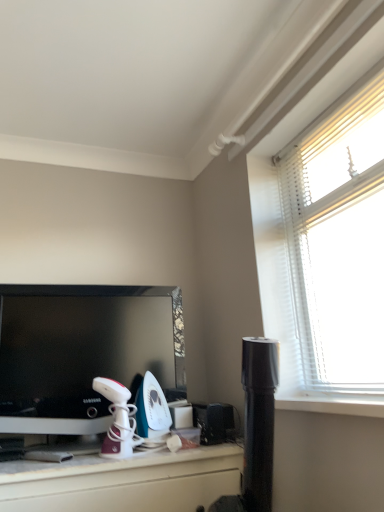
What do you see at coordinates (214, 422) in the screenshot? I see `black plastic speaker at lower center, which ranks as the third appliance in left-to-right order` at bounding box center [214, 422].

In order to face black plastic speaker at lower center, which ranks as the third appliance in left-to-right order, should I rotate leftwards or rightwards?

You should rotate right by 4.251 degrees.

Image resolution: width=384 pixels, height=512 pixels. What do you see at coordinates (151, 409) in the screenshot? I see `teal glossy iron at center, acting as the 2th appliance starting from the right` at bounding box center [151, 409].

The width and height of the screenshot is (384, 512). Identify the location of white glossy iron at center, marked as the first appliance in a left-to-right arrangement. (118, 419).

This screenshot has height=512, width=384. What are the coordinates of `black plastic speaker at lower center, which ranks as the third appliance in left-to-right order` in the screenshot? It's located at (214, 422).

Is the depth of black glossy television at left less than that of black plastic speaker at lower center, arranged as the first appliance when viewed from the right?

Yes.

Based on the photo, is black glossy television at left taller or shorter than black plastic speaker at lower center, arranged as the first appliance when viewed from the right?

Clearly, black glossy television at left is taller compared to black plastic speaker at lower center, arranged as the first appliance when viewed from the right.

Based on their positions, is black glossy television at left located to the left or right of black plastic speaker at lower center, arranged as the first appliance when viewed from the right?

black glossy television at left is to the left of black plastic speaker at lower center, arranged as the first appliance when viewed from the right.

Could you tell me if black glossy television at left is turned towards black plastic speaker at lower center, arranged as the first appliance when viewed from the right?

No, black glossy television at left is not facing towards black plastic speaker at lower center, arranged as the first appliance when viewed from the right.

From a real-world perspective, who is located lower, black glossy television at left or white glossy iron at center, marked as the first appliance in a left-to-right arrangement?

white glossy iron at center, marked as the first appliance in a left-to-right arrangement, from a real-world perspective.

Is the surface of black glossy television at left in direct contact with white glossy iron at center, marked as the first appliance in a left-to-right arrangement?

They are not placed beside each other.

Which is in front, point (119, 313) or point (109, 428)?

Point (109, 428)

How many degrees apart are the facing directions of teal glossy iron at center, the second appliance positioned from the left, and white glossy iron at center, marked as the first appliance in a left-to-right arrangement?

The facing directions of teal glossy iron at center, the second appliance positioned from the left, and white glossy iron at center, marked as the first appliance in a left-to-right arrangement, are 20.9 degrees apart.

Could you tell me if teal glossy iron at center, acting as the 2th appliance starting from the right, is facing white glossy iron at center, arranged as the third appliance when viewed from the right?

No, teal glossy iron at center, acting as the 2th appliance starting from the right, is not facing towards white glossy iron at center, arranged as the third appliance when viewed from the right.

Locate an element on the screen. The height and width of the screenshot is (512, 384). appliance on the left of teal glossy iron at center, the second appliance positioned from the left is located at coordinates (118, 419).

Does point (154, 408) appear closer or farther from the camera than point (136, 410)?

Point (154, 408) is farther from the camera than point (136, 410).

Who is bigger, white glossy iron at center, arranged as the third appliance when viewed from the right, or teal glossy iron at center, acting as the 2th appliance starting from the right?

With larger size is teal glossy iron at center, acting as the 2th appliance starting from the right.

Is white glossy iron at center, marked as the first appliance in a left-to-right arrangement, positioned with its back to teal glossy iron at center, the second appliance positioned from the left?

white glossy iron at center, marked as the first appliance in a left-to-right arrangement, does not have its back to teal glossy iron at center, the second appliance positioned from the left.

Measure the distance between white glossy iron at center, marked as the first appliance in a left-to-right arrangement, and teal glossy iron at center, the second appliance positioned from the left.

They are 3.59 inches apart.

Is white glossy iron at center, arranged as the third appliance when viewed from the right, wider or thinner than teal glossy iron at center, acting as the 2th appliance starting from the right?

white glossy iron at center, arranged as the third appliance when viewed from the right, is thinner than teal glossy iron at center, acting as the 2th appliance starting from the right.

Would you say black glossy television at left is a long distance from teal glossy iron at center, acting as the 2th appliance starting from the right?

No.

Does black glossy television at left contain teal glossy iron at center, acting as the 2th appliance starting from the right?

Yes, black glossy television at left is surrounding teal glossy iron at center, acting as the 2th appliance starting from the right.

Which object is further away from the camera taking this photo, black glossy television at left or teal glossy iron at center, the second appliance positioned from the left?

teal glossy iron at center, the second appliance positioned from the left, is further away from the camera.

Does white glossy iron at center, marked as the first appliance in a left-to-right arrangement, have a larger size compared to black plastic speaker at lower center, arranged as the first appliance when viewed from the right?

Indeed, white glossy iron at center, marked as the first appliance in a left-to-right arrangement, has a larger size compared to black plastic speaker at lower center, arranged as the first appliance when viewed from the right.

In the scene shown: From the image's perspective, which one is positioned lower, white glossy iron at center, arranged as the third appliance when viewed from the right, or black plastic speaker at lower center, which ranks as the third appliance in left-to-right order?

black plastic speaker at lower center, which ranks as the third appliance in left-to-right order, appears lower in the image.

Is white glossy iron at center, marked as the first appliance in a left-to-right arrangement, to the left or to the right of black plastic speaker at lower center, arranged as the first appliance when viewed from the right, in the image?

white glossy iron at center, marked as the first appliance in a left-to-right arrangement, is positioned on black plastic speaker at lower center, arranged as the first appliance when viewed from the right,'s left side.

Is white glossy iron at center, marked as the first appliance in a left-to-right arrangement, positioned with its back to black plastic speaker at lower center, which ranks as the third appliance in left-to-right order?

No, white glossy iron at center, marked as the first appliance in a left-to-right arrangement,'s orientation is not away from black plastic speaker at lower center, which ranks as the third appliance in left-to-right order.

What's the angular difference between white glossy iron at center, marked as the first appliance in a left-to-right arrangement, and black glossy television at left's facing directions?

white glossy iron at center, marked as the first appliance in a left-to-right arrangement, and black glossy television at left are facing 1.45 degrees away from each other.

Find the location of a particular element. television that is above the white glossy iron at center, arranged as the third appliance when viewed from the right (from a real-world perspective) is located at coordinates 81,351.

Is white glossy iron at center, arranged as the third appliance when viewed from the right, positioned far away from black glossy television at left?

No.

Is the depth of white glossy iron at center, marked as the first appliance in a left-to-right arrangement, greater than that of black glossy television at left?

No, white glossy iron at center, marked as the first appliance in a left-to-right arrangement, is closer to the viewer.

Locate an element on the screen. This screenshot has width=384, height=512. television above the black plastic speaker at lower center, arranged as the first appliance when viewed from the right (from a real-world perspective) is located at coordinates (81, 351).

This screenshot has height=512, width=384. What are the coordinates of `the 2nd appliance directly beneath the black glossy television at left (from a real-world perspective)` in the screenshot? It's located at (118, 419).

Considering their positions, is black glossy television at left positioned closer to black plastic speaker at lower center, which ranks as the third appliance in left-to-right order, than white glossy iron at center, marked as the first appliance in a left-to-right arrangement?

Based on the image, white glossy iron at center, marked as the first appliance in a left-to-right arrangement, appears to be nearer to black plastic speaker at lower center, which ranks as the third appliance in left-to-right order.

When comparing their distances from black glossy television at left, does teal glossy iron at center, the second appliance positioned from the left, or white glossy iron at center, marked as the first appliance in a left-to-right arrangement, seem further?

The object further to black glossy television at left is teal glossy iron at center, the second appliance positioned from the left.

Looking at the image, which one is located closer to white glossy iron at center, arranged as the third appliance when viewed from the right, teal glossy iron at center, acting as the 2th appliance starting from the right, or black glossy television at left?

teal glossy iron at center, acting as the 2th appliance starting from the right, lies closer to white glossy iron at center, arranged as the third appliance when viewed from the right, than the other object.

Estimate the real-world distances between objects in this image. Which object is closer to teal glossy iron at center, acting as the 2th appliance starting from the right, black plastic speaker at lower center, arranged as the first appliance when viewed from the right, or black glossy television at left?

Based on the image, black plastic speaker at lower center, arranged as the first appliance when viewed from the right, appears to be nearer to teal glossy iron at center, acting as the 2th appliance starting from the right.

From the image, which object appears to be nearer to black glossy television at left, black plastic speaker at lower center, arranged as the first appliance when viewed from the right, or teal glossy iron at center, the second appliance positioned from the left?

teal glossy iron at center, the second appliance positioned from the left.

When comparing their distances from black plastic speaker at lower center, which ranks as the third appliance in left-to-right order, does teal glossy iron at center, acting as the 2th appliance starting from the right, or white glossy iron at center, arranged as the third appliance when viewed from the right, seem further?

Among the two, white glossy iron at center, arranged as the third appliance when viewed from the right, is located further to black plastic speaker at lower center, which ranks as the third appliance in left-to-right order.

Which object lies further to the anchor point black plastic speaker at lower center, which ranks as the third appliance in left-to-right order, white glossy iron at center, marked as the first appliance in a left-to-right arrangement, or black glossy television at left?

Among the two, black glossy television at left is located further to black plastic speaker at lower center, which ranks as the third appliance in left-to-right order.

Which object lies nearer to the anchor point teal glossy iron at center, acting as the 2th appliance starting from the right, white glossy iron at center, arranged as the third appliance when viewed from the right, or black glossy television at left?

The object closer to teal glossy iron at center, acting as the 2th appliance starting from the right, is white glossy iron at center, arranged as the third appliance when viewed from the right.

Where is `appliance between white glossy iron at center, marked as the first appliance in a left-to-right arrangement, and black plastic speaker at lower center, arranged as the first appliance when viewed from the right, in the horizontal direction`? This screenshot has width=384, height=512. appliance between white glossy iron at center, marked as the first appliance in a left-to-right arrangement, and black plastic speaker at lower center, arranged as the first appliance when viewed from the right, in the horizontal direction is located at coordinates (151, 409).

The height and width of the screenshot is (512, 384). I want to click on appliance between black glossy television at left and teal glossy iron at center, the second appliance positioned from the left, from left to right, so pos(118,419).